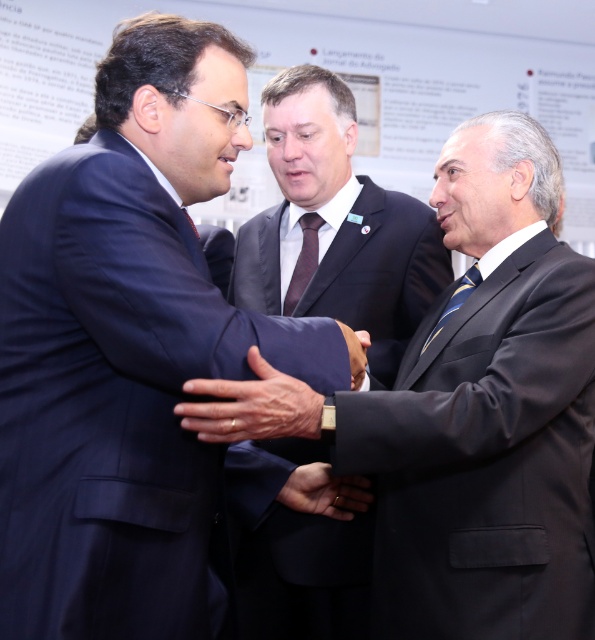
Question: Which point appears closest to the camera in this image?

Choices:
 (A) (183, 208)
 (B) (355, 481)
 (C) (209, 564)
 (D) (593, 301)

Answer: (A)

Question: Is dark brown silk tie at center positioned behind blue striped tie at center?

Choices:
 (A) no
 (B) yes

Answer: (B)

Question: Which point is closer to the camera?

Choices:
 (A) matte black tie at center
 (B) black matte suit at center
 (C) dark brown silk tie at center
 (D) smooth leather hand at center

Answer: (A)

Question: Can you confirm if matte black suit at center is positioned below smooth skin hand at center?

Choices:
 (A) no
 (B) yes

Answer: (A)

Question: Does matte black suit at center have a lesser width compared to navy blue suit at center?

Choices:
 (A) no
 (B) yes

Answer: (A)

Question: Among these points, which one is nearest to the camera?

Choices:
 (A) (358, 349)
 (B) (306, 484)
 (C) (206, 381)

Answer: (C)